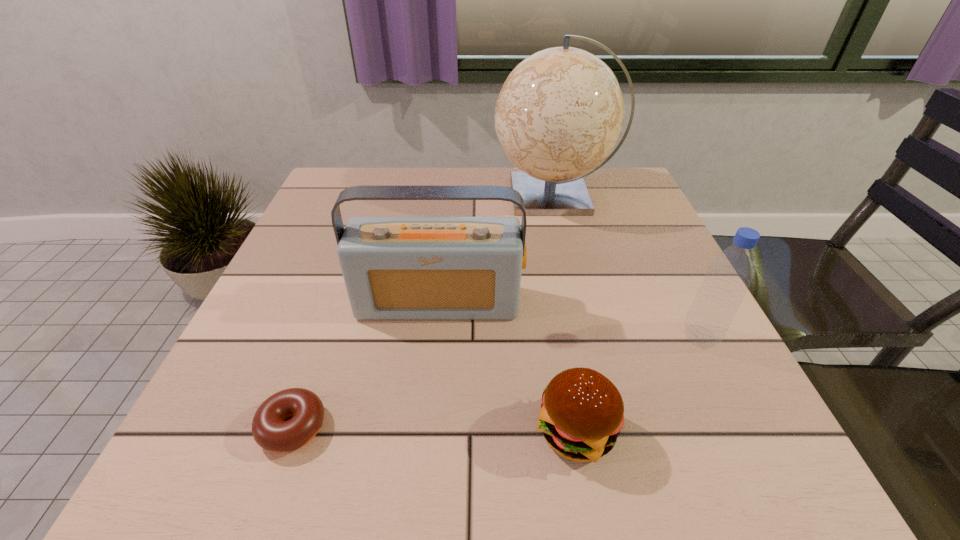
At what (x,y) coordinates should I click in order to perform the action: click on object situated at the far right corner. Please return your answer as a coordinate pair (x, y). The height and width of the screenshot is (540, 960). Looking at the image, I should click on (560, 112).

Locate an element on the screen. This screenshot has height=540, width=960. vacant space at the far edge is located at coordinates (380, 205).

Identify the location of vacant area at the left edge of the desktop. The image size is (960, 540). (284, 271).

Where is `free region at the right edge`? The image size is (960, 540). free region at the right edge is located at coordinates (717, 404).

The height and width of the screenshot is (540, 960). I want to click on blank space at the far left corner, so click(x=329, y=181).

Find the location of a particular element. The image size is (960, 540). free space at the near left corner is located at coordinates (256, 444).

Locate an element on the screen. Image resolution: width=960 pixels, height=540 pixels. vacant space at the near right corner of the desktop is located at coordinates pyautogui.click(x=676, y=467).

The height and width of the screenshot is (540, 960). I want to click on vacant point located between the shortest object and the radio receiver, so click(x=366, y=365).

Locate an element on the screen. The width and height of the screenshot is (960, 540). free space between the farthest object and the fourth tallest object is located at coordinates (565, 313).

The width and height of the screenshot is (960, 540). What are the coordinates of `vacant area that lies between the fourth tallest object and the shortest object` in the screenshot? It's located at (435, 429).